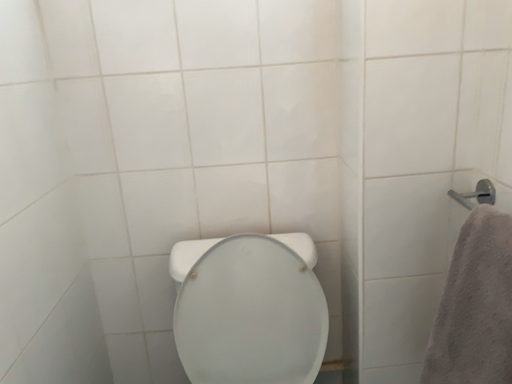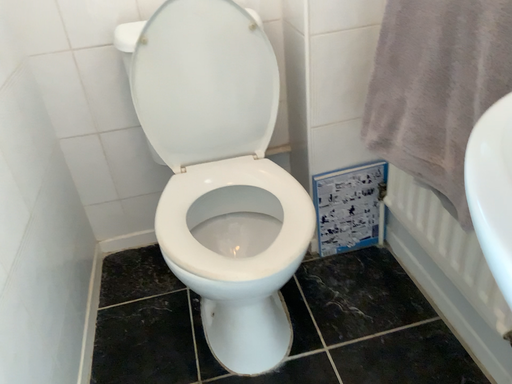
Question: Which way did the camera rotate in the video?

Choices:
 (A) rotated left
 (B) rotated right

Answer: (B)